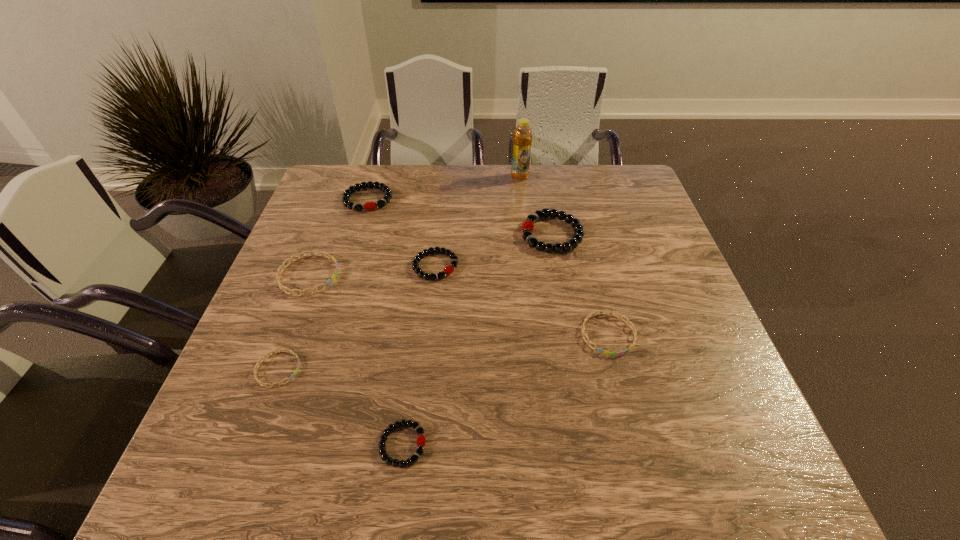
Where is `the nearest bracelet`? This screenshot has width=960, height=540. the nearest bracelet is located at coordinates (421, 441).

Find the location of a particular element. the shortest object is located at coordinates (281, 350).

Where is `the smallest blue bracelet`? The image size is (960, 540). the smallest blue bracelet is located at coordinates (281, 350).

The height and width of the screenshot is (540, 960). Find the location of `free location located on the front of the tallest object`. free location located on the front of the tallest object is located at coordinates (523, 205).

Find the location of a particular element. vacant space located 0.270m on the front of the rightmost black bracelet is located at coordinates (571, 339).

Where is `vacant region located 0.330m on the front of the seventh nearest object`? This screenshot has width=960, height=540. vacant region located 0.330m on the front of the seventh nearest object is located at coordinates (338, 298).

The image size is (960, 540). I want to click on vacant area located 0.320m on the surface of the farthest blue bracelet showing star-shaped elements, so click(467, 275).

Find the location of `vacant point located on the right of the second smallest black bracelet`. vacant point located on the right of the second smallest black bracelet is located at coordinates (615, 266).

Where is `free spot located 0.230m on the surface of the second smallest blue bracelet showing star-shaped elements`? free spot located 0.230m on the surface of the second smallest blue bracelet showing star-shaped elements is located at coordinates (642, 467).

Find the location of a particular element. The height and width of the screenshot is (540, 960). free point located on the left of the smallest black bracelet is located at coordinates (229, 445).